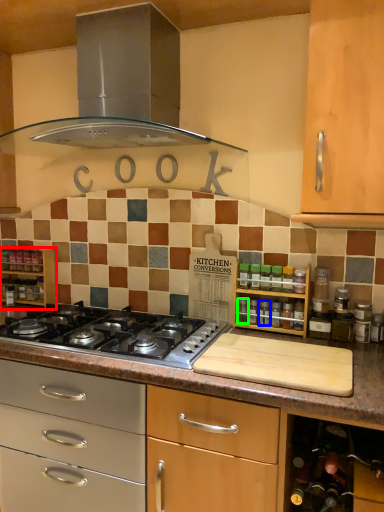
Question: Estimate the real-world distances between objects in this image. Which object is closer to shelf (highlighted by a red box), appliance (highlighted by a blue box) or bottle (highlighted by a green box)?

Choices:
 (A) appliance
 (B) bottle

Answer: (B)